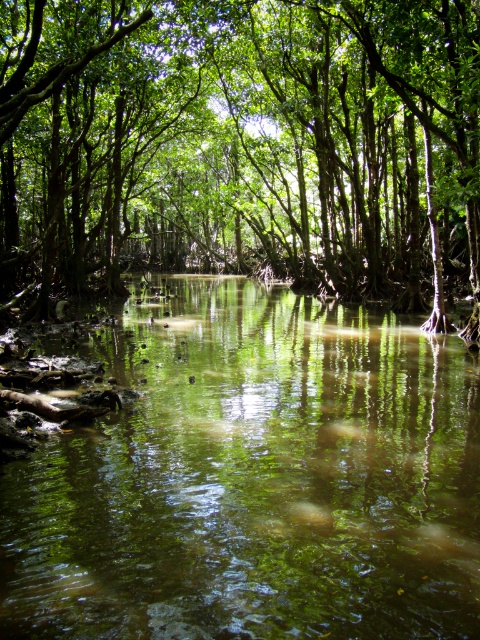
Question: Can you confirm if green reflective water at center is positioned above green leafy tree at center?

Choices:
 (A) yes
 (B) no

Answer: (B)

Question: Is green reflective water at center to the left of green leafy tree at center from the viewer's perspective?

Choices:
 (A) yes
 (B) no

Answer: (B)

Question: Can you confirm if green reflective water at center is thinner than green leafy tree at center?

Choices:
 (A) yes
 (B) no

Answer: (A)